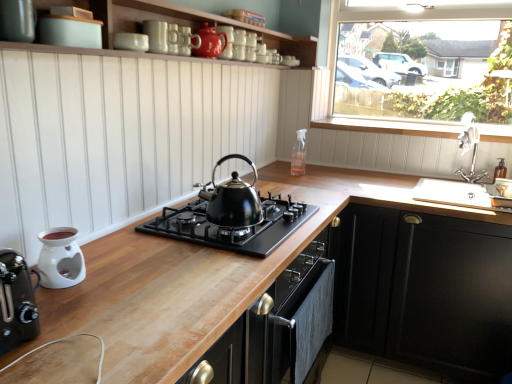
Locate an element on the screen. free space in front of white glossy oil burner at lower left, the 4th appliance viewed from the back is located at coordinates (61, 311).